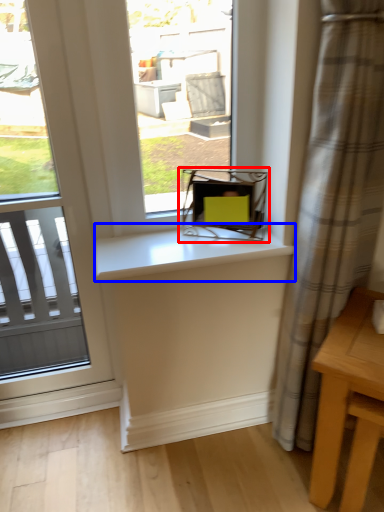
Question: Among these objects, which one is farthest to the camera, chair (highlighted by a red box) or counter top (highlighted by a blue box)?

Choices:
 (A) chair
 (B) counter top

Answer: (A)